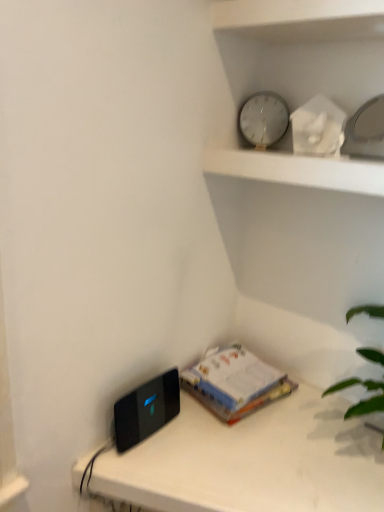
In order to click on free spot in front of black glossy ipod at lower left in this screenshot , I will do `click(147, 464)`.